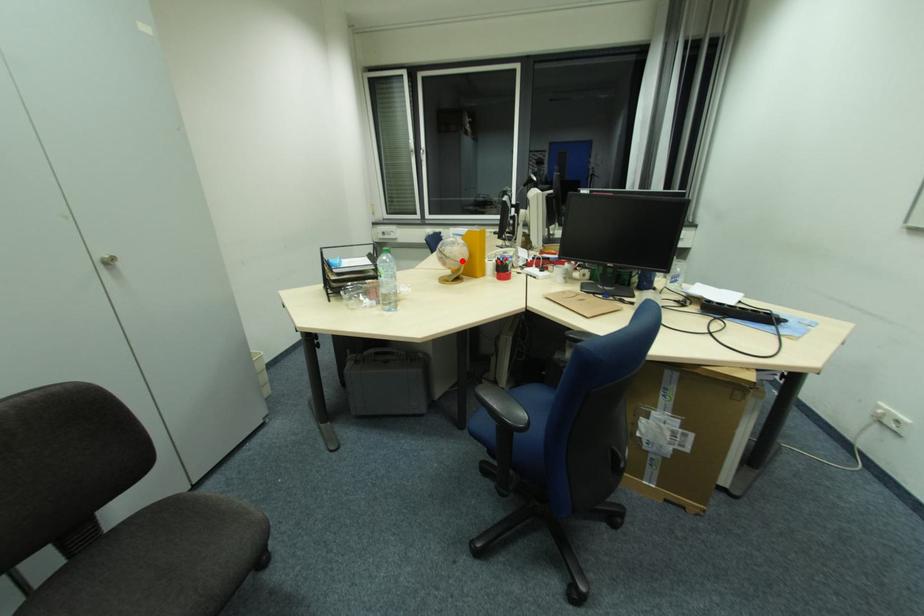
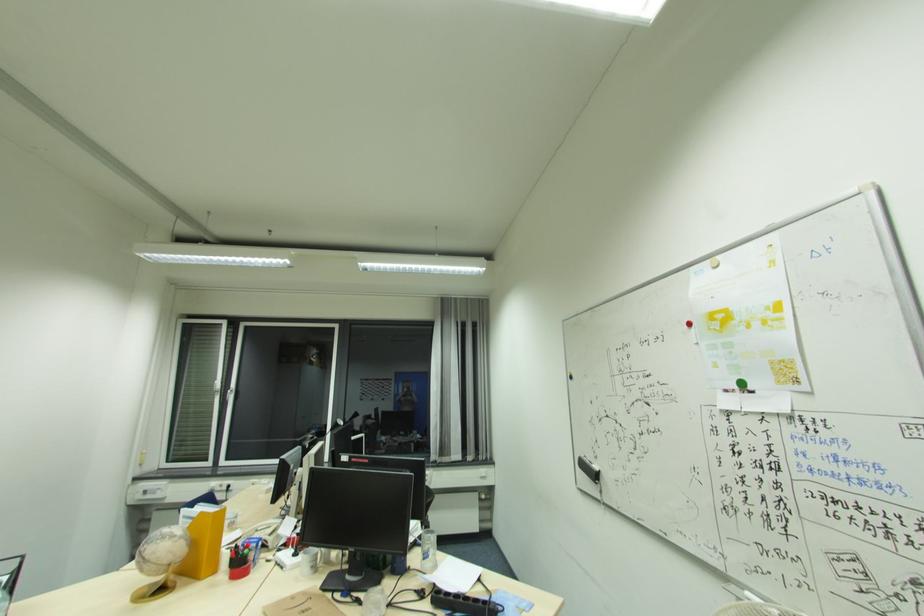
Where in the second image is the point corresponding to the highlighted location from the first image?

(167, 564)